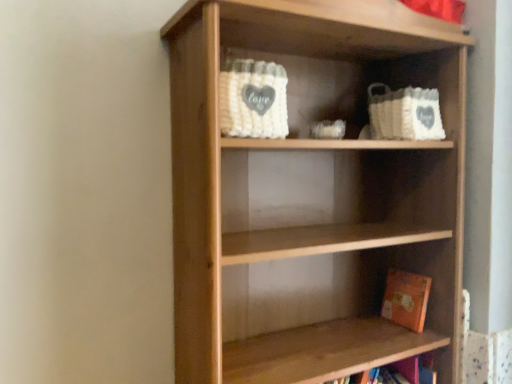
The height and width of the screenshot is (384, 512). Describe the element at coordinates (312, 194) in the screenshot. I see `natural wood shelf at center` at that location.

What is the approximate width of natural wood shelf at center?

It is 13.51 inches.

Measure the distance between natural wood shelf at center and camera.

natural wood shelf at center and camera are 85.40 centimeters apart.

What is the approximate height of natural wood shelf at center?

natural wood shelf at center is 1.23 meters tall.

Identify the location of natural wood shelf at center. (312, 194).

At what (x,y) coordinates should I click in order to perform the action: click on orange matte book at lower right. Please return your answer as a coordinate pair (x, y). Looking at the image, I should click on (406, 299).

The height and width of the screenshot is (384, 512). Describe the element at coordinates (406, 299) in the screenshot. I see `orange matte book at lower right` at that location.

What is the approximate width of orange matte book at lower right?

orange matte book at lower right is 7.41 inches wide.

Identify the location of natural wood shelf at center. The width and height of the screenshot is (512, 384). (312, 194).

Between natural wood shelf at center and orange matte book at lower right, which one appears on the right side from the viewer's perspective?

orange matte book at lower right is more to the right.

Is natural wood shelf at center in front of orange matte book at lower right?

Yes, it is.

Which is nearer, (x=254, y=340) or (x=403, y=323)?

Point (x=254, y=340) is closer to the camera than point (x=403, y=323).

From the image's perspective, is natural wood shelf at center located above orange matte book at lower right?

Yes.

Based on the photo, from a real-world perspective, which object stands above the other?

natural wood shelf at center.

Consider the image. Does natural wood shelf at center have a lesser width compared to orange matte book at lower right?

No.

Considering the sizes of objects natural wood shelf at center and orange matte book at lower right in the image provided, who is taller, natural wood shelf at center or orange matte book at lower right?

natural wood shelf at center.

Considering the sizes of objects natural wood shelf at center and orange matte book at lower right in the image provided, who is bigger, natural wood shelf at center or orange matte book at lower right?

Bigger between the two is natural wood shelf at center.

Is natural wood shelf at center completely or partially outside of orange matte book at lower right?

Absolutely, natural wood shelf at center is external to orange matte book at lower right.

Is there a large distance between natural wood shelf at center and orange matte book at lower right?

No, natural wood shelf at center is not far from orange matte book at lower right.

Is natural wood shelf at center positioned with its back to orange matte book at lower right?

Yes.

Measure the distance between natural wood shelf at center and orange matte book at lower right.

natural wood shelf at center is 17.73 inches away from orange matte book at lower right.

There is a orange matte book at lower right. At what (x,y) coordinates should I click in order to perform the action: click on shelf above it (from a real-world perspective). Please return your answer as a coordinate pair (x, y). Image resolution: width=512 pixels, height=384 pixels. Looking at the image, I should click on (312, 194).

Is orange matte book at lower right to the left of natural wood shelf at center from the viewer's perspective?

Incorrect, orange matte book at lower right is not on the left side of natural wood shelf at center.

Does orange matte book at lower right lie in front of natural wood shelf at center?

No, orange matte book at lower right is further to the viewer.

Is point (423, 278) positioned before point (262, 160)?

No, (423, 278) is behind (262, 160).

From the image's perspective, which one is positioned higher, orange matte book at lower right or natural wood shelf at center?

From the image's view, natural wood shelf at center is above.

From the picture: From a real-world perspective, is orange matte book at lower right under natural wood shelf at center?

Correct, in the physical world, orange matte book at lower right is lower than natural wood shelf at center.

Is orange matte book at lower right wider or thinner than natural wood shelf at center?

Clearly, orange matte book at lower right has less width compared to natural wood shelf at center.

Who is shorter, orange matte book at lower right or natural wood shelf at center?

Standing shorter between the two is orange matte book at lower right.

Can you confirm if orange matte book at lower right is smaller than natural wood shelf at center?

Yes.

Would you say natural wood shelf at center is part of orange matte book at lower right's contents?

No.

Consider the image. Is orange matte book at lower right beside natural wood shelf at center?

No.

Is orange matte book at lower right positioned with its back to natural wood shelf at center?

Yes.

How many degrees apart are the facing directions of orange matte book at lower right and natural wood shelf at center?

The facing directions of orange matte book at lower right and natural wood shelf at center are 0.435 degrees apart.

How distant is orange matte book at lower right from natural wood shelf at center?

orange matte book at lower right is 17.73 inches away from natural wood shelf at center.

Find the location of `book on the right of natural wood shelf at center`. book on the right of natural wood shelf at center is located at coordinates (406, 299).

Locate an element on the screen. shelf above the orange matte book at lower right (from a real-world perspective) is located at coordinates (312, 194).

Locate an element on the screen. Image resolution: width=512 pixels, height=384 pixels. shelf lying in front of the orange matte book at lower right is located at coordinates (312, 194).